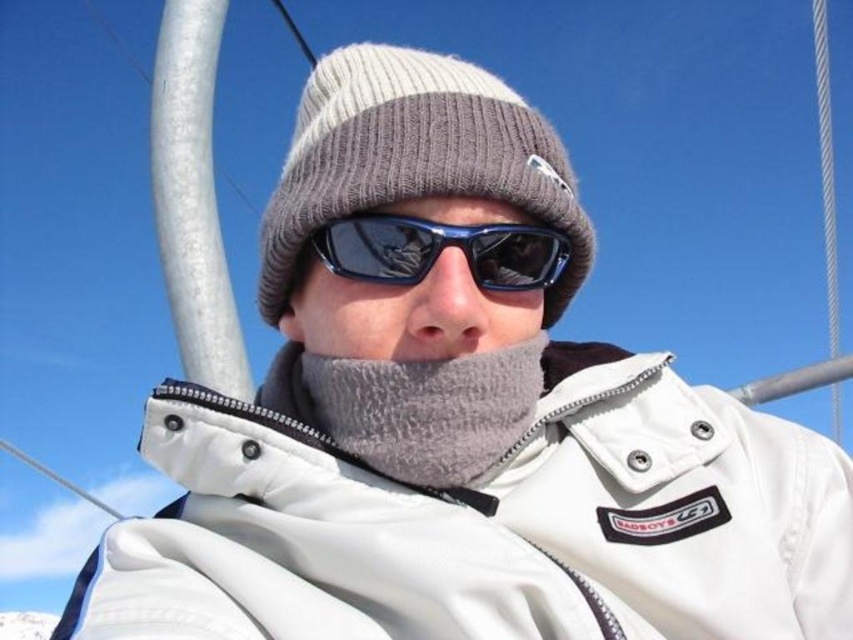
Question: Which of these objects is positioned closest to the white fleece jacket at center?

Choices:
 (A) gray fuzzy scarf at center
 (B) knit woolen beanie at center
 (C) blue reflective plastic goggles at center

Answer: (A)

Question: Can you confirm if white fleece jacket at center is positioned above knit woolen beanie at center?

Choices:
 (A) no
 (B) yes

Answer: (A)

Question: Which point is farther to the camera?

Choices:
 (A) knit woolen beanie at center
 (B) gray fuzzy scarf at center

Answer: (A)

Question: Is knit woolen beanie at center in front of gray fuzzy scarf at center?

Choices:
 (A) yes
 (B) no

Answer: (B)

Question: Which of the following is the farthest from the observer?

Choices:
 (A) (425, 97)
 (B) (572, 410)
 (C) (403, 465)

Answer: (B)

Question: Is white fleece jacket at center thinner than blue reflective plastic goggles at center?

Choices:
 (A) yes
 (B) no

Answer: (B)